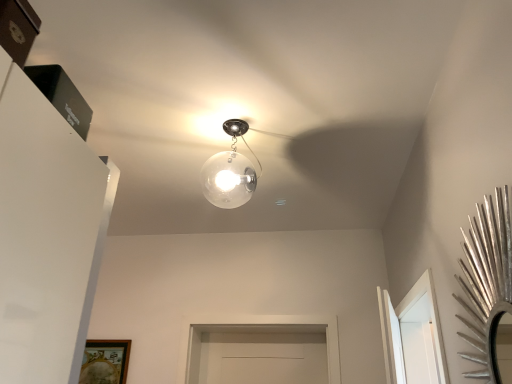
The width and height of the screenshot is (512, 384). What do you see at coordinates (105, 362) in the screenshot? I see `wooden painted frame at lower left` at bounding box center [105, 362].

Where is `wooden painted frame at lower left`? This screenshot has height=384, width=512. wooden painted frame at lower left is located at coordinates (105, 362).

Identify the location of wooden painted frame at lower left. The height and width of the screenshot is (384, 512). (105, 362).